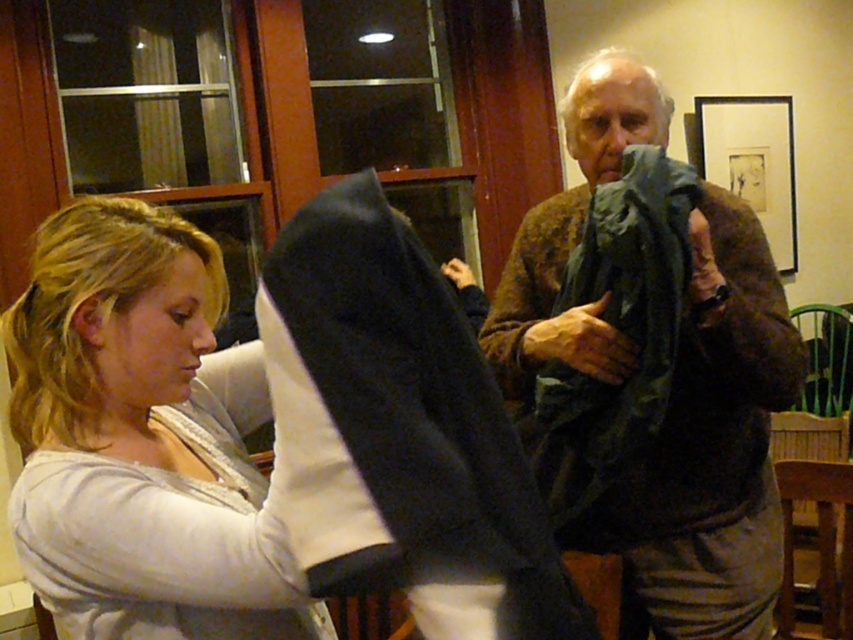
You are a photographer setting up for a portrait session in this room. You want to position a spotlight so that it illuminates both the black soft fabric at center and the textured brown sweater at upper right without casting shadows on the background wall. Given their positions, where should you place the spotlight relative to these objects?

The black soft fabric at center is located below the textured brown sweater at upper right. To avoid casting shadows on the background wall, the spotlight should be placed above and between the two objects, ensuring light falls evenly on both without obstruction.

You are a tailor trying to determine which fabric to use for a tailored suit. You have two options in front of you at the center of the image. Which fabric is shorter in length between the black soft fabric at center and the dark green fabric at center?

The black soft fabric at center is shorter than the dark green fabric at center, so the black soft fabric at center would be the shorter option for the tailored suit.

You are a tailor trying to determine the appropriate size for a new garment. You observe the textured brown sweater at upper right and the dark green fabric at center. Which object is taller in the image?

The textured brown sweater at upper right is taller than the dark green fabric at center.